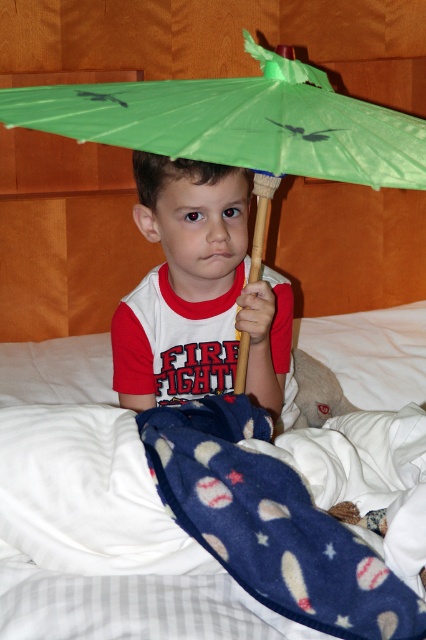
Question: Is green paper umbrella at center thinner than matte green umbrella at center?

Choices:
 (A) no
 (B) yes

Answer: (A)

Question: Is white fleece blanket at center positioned before matte green umbrella at center?

Choices:
 (A) no
 (B) yes

Answer: (B)

Question: Which object is farther from the camera taking this photo?

Choices:
 (A) green paper umbrella at center
 (B) matte green umbrella at center
 (C) white fleece blanket at center

Answer: (A)

Question: In this image, where is white fleece blanket at center located relative to green paper umbrella at center?

Choices:
 (A) right
 (B) left

Answer: (A)

Question: Estimate the real-world distances between objects in this image. Which object is farther from the white fleece blanket at center?

Choices:
 (A) matte green umbrella at center
 (B) green paper umbrella at center

Answer: (B)

Question: Which point appears farthest from the camera in this image?

Choices:
 (A) (127, 524)
 (B) (83, 310)
 (C) (210, 374)

Answer: (B)